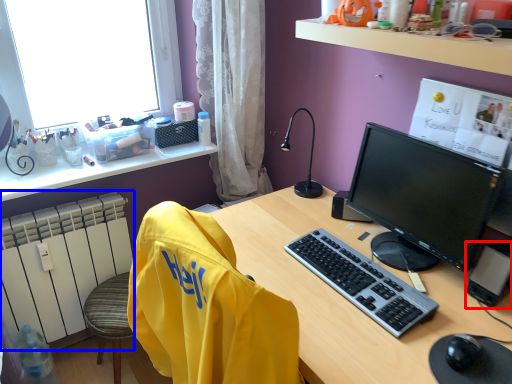
Question: Which of the following is the farthest to the observer, computer tower (highlighted by a red box) or radiator (highlighted by a blue box)?

Choices:
 (A) computer tower
 (B) radiator

Answer: (B)